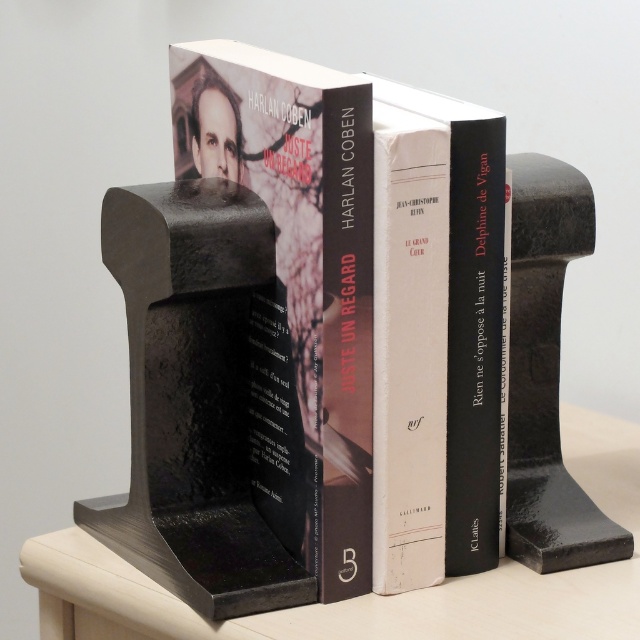
Question: Is matte black book at center to the right of smooth matte black bookends at center from the viewer's perspective?

Choices:
 (A) no
 (B) yes

Answer: (A)

Question: Is matte black book at center in front of smooth matte black bookends at center?

Choices:
 (A) no
 (B) yes

Answer: (B)

Question: Which of the following is the closest to the observer?

Choices:
 (A) smooth matte black bookends at center
 (B) matte black book at center

Answer: (B)

Question: Can you confirm if matte black book at center is bigger than smooth matte black bookends at center?

Choices:
 (A) yes
 (B) no

Answer: (B)

Question: Which point is farther to the camera?

Choices:
 (A) smooth matte black bookends at center
 (B) matte black book at center

Answer: (A)